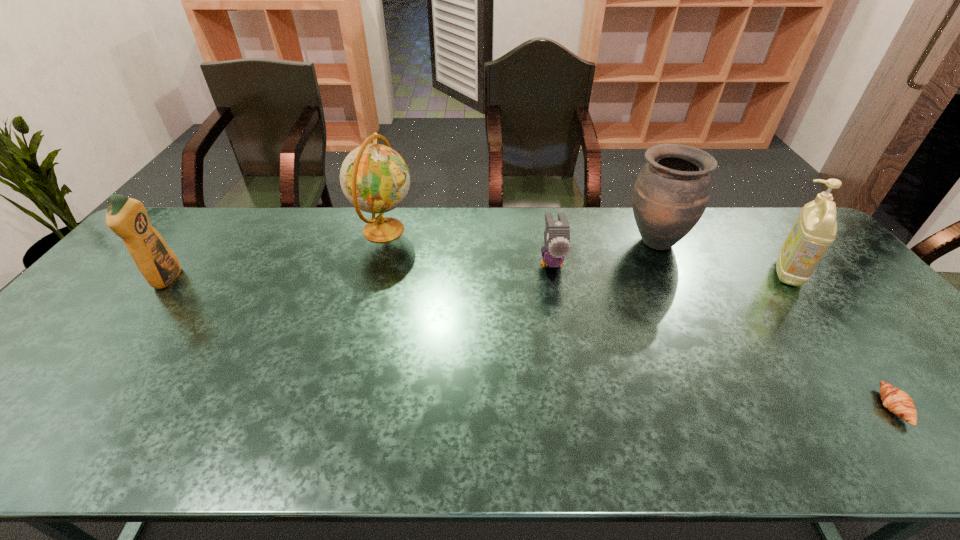
Where is `globe`? globe is located at coordinates (374, 178).

Where is `the third object from right to left`? the third object from right to left is located at coordinates (672, 190).

Find the location of `the leftmost object`. the leftmost object is located at coordinates (126, 217).

I want to click on the right detergent, so click(x=815, y=229).

Locate an element on the screen. The width and height of the screenshot is (960, 540). bird is located at coordinates (557, 233).

Where is `the fifth tallest object`? the fifth tallest object is located at coordinates (557, 233).

Identify the location of the nearest object. (897, 401).

Find the location of a particular element. This screenshot has height=540, width=960. the shortest object is located at coordinates (897, 401).

Identify the location of free space located on the left of the globe. (310, 230).

This screenshot has height=540, width=960. Identify the location of vacant space positioned 0.250m on the left of the urn. (545, 241).